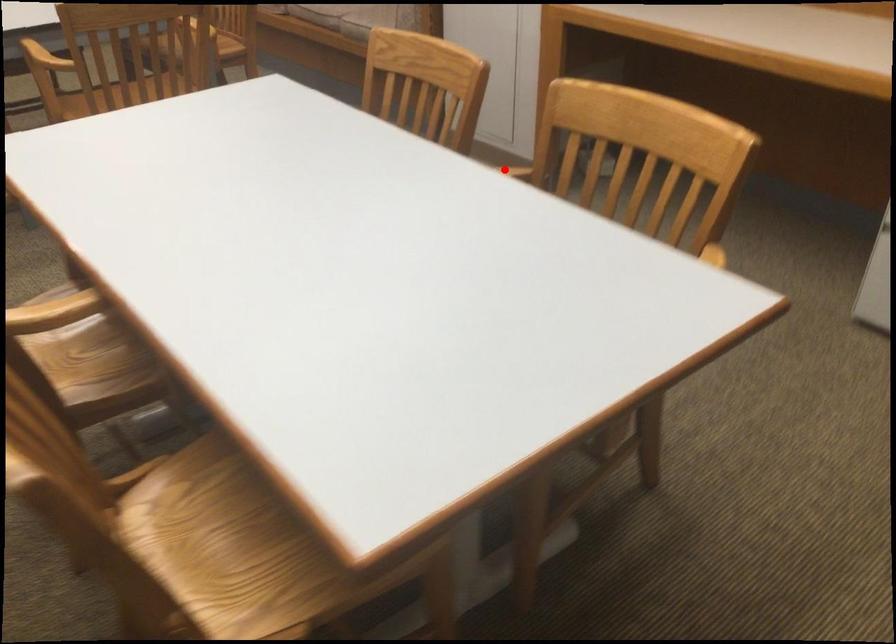
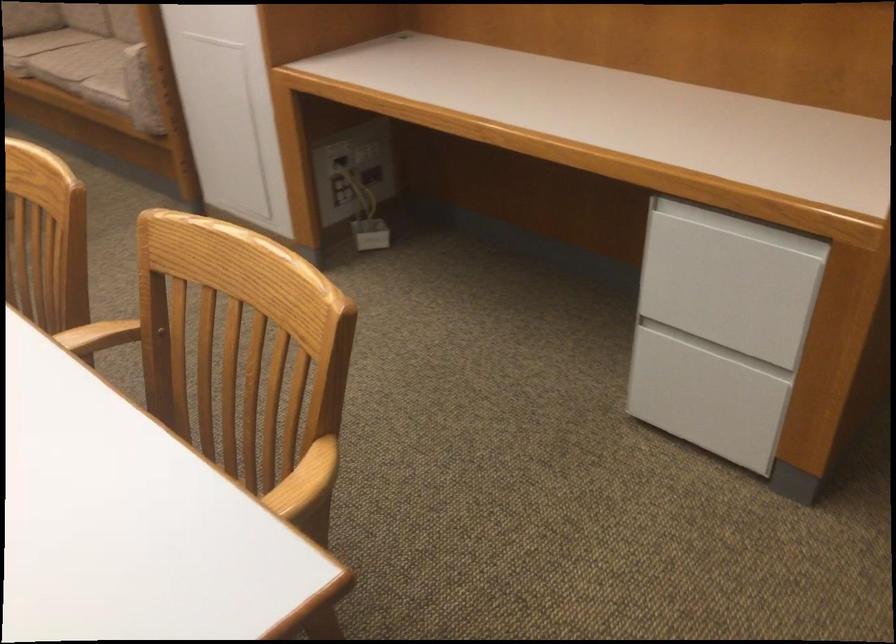
Question: A red point is marked in image1. In image2, is the corresponding 3D point closer to the camera or farther? Reply with the corresponding letter.

Choices:
 (A) The corresponding 3D point is closer.
 (B) The corresponding 3D point is farther.

Answer: (A)